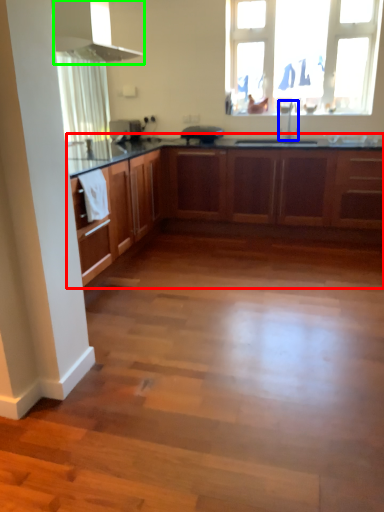
Question: Which is nearer to the cabinetry (highlighted by a red box)? tap (highlighted by a blue box) or exhaust hood (highlighted by a green box).

Choices:
 (A) tap
 (B) exhaust hood

Answer: (A)